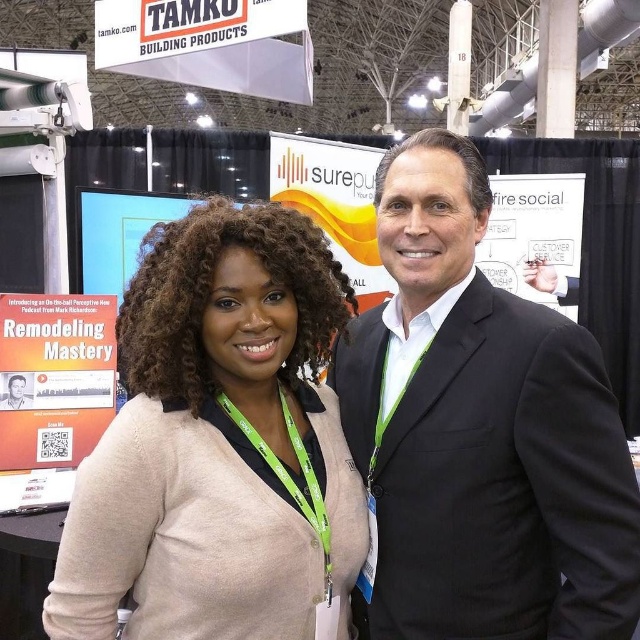
Can you confirm if black suit at center is bigger than beige cardigan at center?

Yes.

Is point (557, 524) positioned behind point (64, 563)?

That is True.

What are the coordinates of `black suit at center` in the screenshot? It's located at (481, 432).